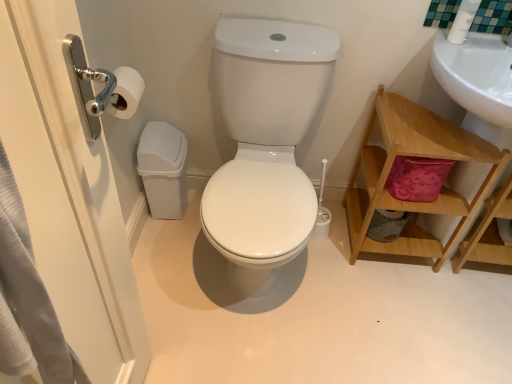
Find the location of `spots to the right of white glossy toilet at center`. spots to the right of white glossy toilet at center is located at coordinates (367, 303).